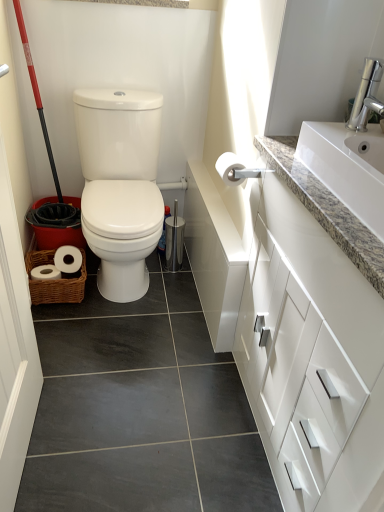
Question: From the image's perspective, is white glossy cabinet at upper right on top of white granite sink at upper right?

Choices:
 (A) yes
 (B) no

Answer: (B)

Question: Can you confirm if white glossy cabinet at upper right is smaller than white granite sink at upper right?

Choices:
 (A) yes
 (B) no

Answer: (B)

Question: Can you confirm if white glossy cabinet at upper right is shorter than white granite sink at upper right?

Choices:
 (A) no
 (B) yes

Answer: (A)

Question: Would you say white glossy cabinet at upper right is outside white granite sink at upper right?

Choices:
 (A) yes
 (B) no

Answer: (A)

Question: Considering the relative positions of white glossy cabinet at upper right and white granite sink at upper right in the image provided, is white glossy cabinet at upper right in front of white granite sink at upper right?

Choices:
 (A) yes
 (B) no

Answer: (A)

Question: Which is correct: white granite sink at upper right is inside silver metallic faucet at upper right, or outside of it?

Choices:
 (A) outside
 (B) inside

Answer: (A)

Question: Considering the positions of point (331, 177) and point (360, 113), is point (331, 177) closer or farther from the camera than point (360, 113)?

Choices:
 (A) closer
 (B) farther

Answer: (A)

Question: From the image's perspective, relative to silver metallic faucet at upper right, is white granite sink at upper right above or below?

Choices:
 (A) below
 (B) above

Answer: (A)

Question: From their relative heights in the image, would you say white granite sink at upper right is taller or shorter than silver metallic faucet at upper right?

Choices:
 (A) short
 (B) tall

Answer: (A)

Question: Do you think white glossy cabinet at upper right is within white granite sink at upper right, or outside of it?

Choices:
 (A) outside
 (B) inside

Answer: (A)

Question: Visually, is white glossy cabinet at upper right positioned to the left or to the right of white granite sink at upper right?

Choices:
 (A) right
 (B) left

Answer: (B)

Question: From the image's perspective, is white glossy cabinet at upper right positioned above or below white granite sink at upper right?

Choices:
 (A) below
 (B) above

Answer: (A)

Question: Based on their sizes in the image, would you say white glossy cabinet at upper right is bigger or smaller than white granite sink at upper right?

Choices:
 (A) big
 (B) small

Answer: (A)

Question: Is point (362, 125) closer or farther from the camera than point (226, 154)?

Choices:
 (A) closer
 (B) farther

Answer: (A)

Question: In terms of width, does silver metallic faucet at upper right look wider or thinner when compared to white matte toilet paper at upper right?

Choices:
 (A) wide
 (B) thin

Answer: (B)